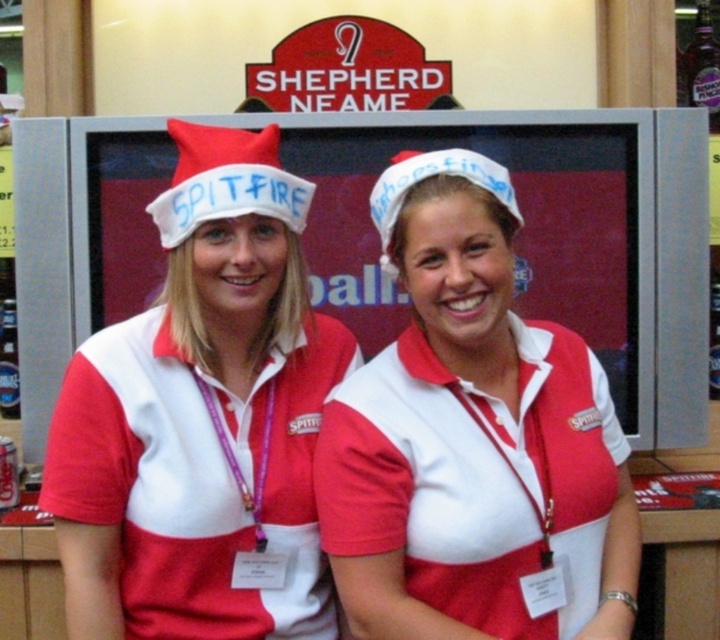
Question: Among these points, which one is nearest to the camera?

Choices:
 (A) (186, 193)
 (B) (253, 422)
 (C) (490, 570)

Answer: (C)

Question: Which object is farther from the camera taking this photo?

Choices:
 (A) white matte santa hat at center
 (B) matte fabric hat at center

Answer: (B)

Question: Is matte fabric hat at center above red felt santa hat at center?

Choices:
 (A) no
 (B) yes

Answer: (A)

Question: From the image, what is the correct spatial relationship of matte fabric hat at center in relation to red felt santa hat at center?

Choices:
 (A) right
 (B) left

Answer: (B)

Question: Does matte fabric hat at center have a smaller size compared to white matte santa hat at center?

Choices:
 (A) no
 (B) yes

Answer: (A)

Question: Which is nearer to the matte fabric hat at center?

Choices:
 (A) white matte santa hat at center
 (B) red felt santa hat at center

Answer: (B)